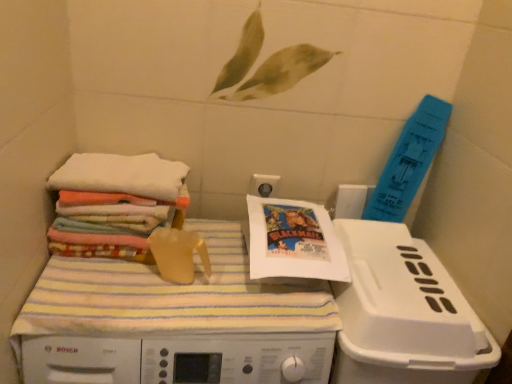
In order to click on vacant region to the right of multicolored fabric stack at left in this screenshot , I will do `click(223, 256)`.